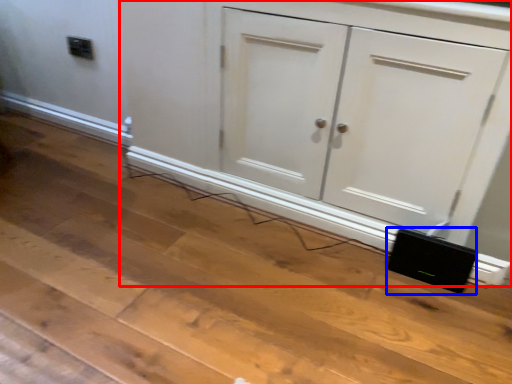
Question: Which of the following is the farthest to the observer, cupboard (highlighted by a red box) or speaker (highlighted by a blue box)?

Choices:
 (A) cupboard
 (B) speaker

Answer: (B)